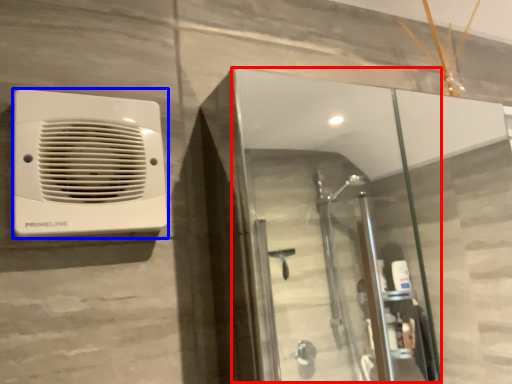
Question: Which object is closer to the camera taking this photo, screen door (highlighted by a red box) or home appliance (highlighted by a blue box)?

Choices:
 (A) screen door
 (B) home appliance

Answer: (A)